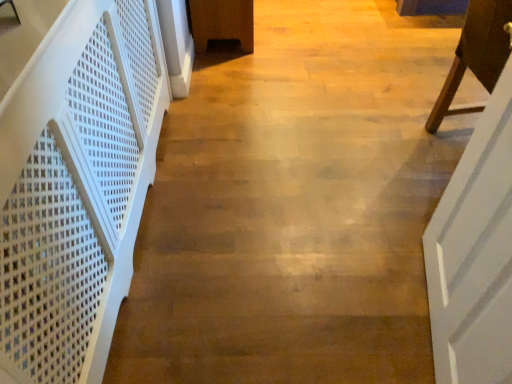
This screenshot has width=512, height=384. In order to click on vacant space to the left of white wooden door at right in this screenshot , I will do `click(331, 305)`.